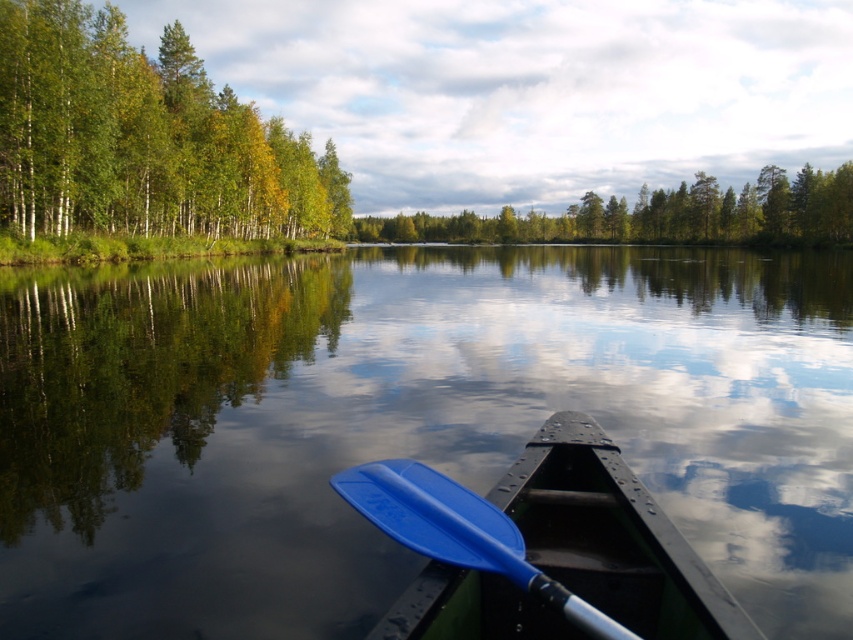
You are standing at the lakeshore and see the transparent water at center and the green matte tree at center. Which object is closer to you?

The transparent water at center is closer to the viewer than the green matte tree at center.

Consider the image. You are standing on the lakeshore and want to take a photo of the green matte trees at left and the transparent water at center. Which object should you focus on first if you want to capture both in a single shot without moving the camera?

You should focus on the green matte trees at left first because the transparent water at center is to the right of them, so adjusting the camera frame to include both would require ensuring the trees are on the left edge and the water occupies the central area to the right.